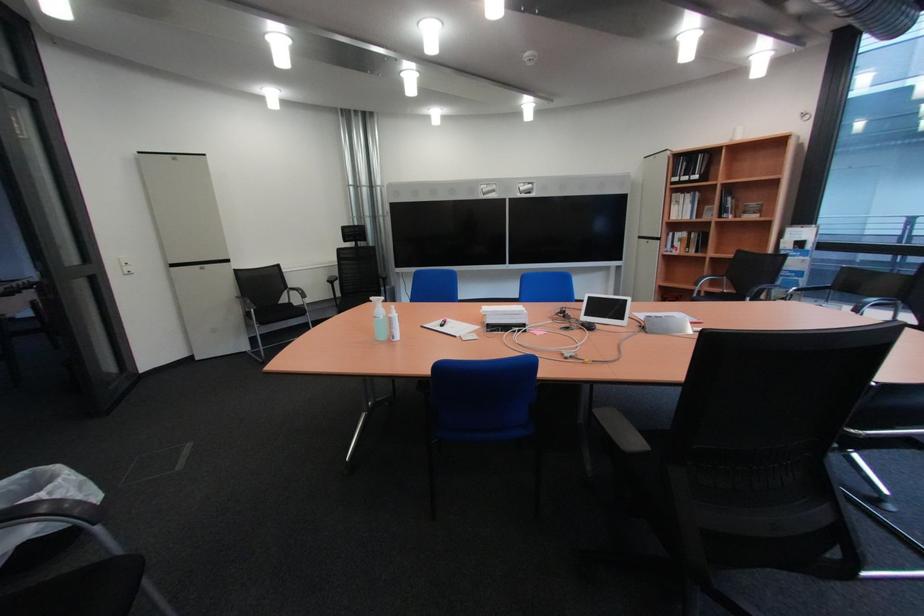
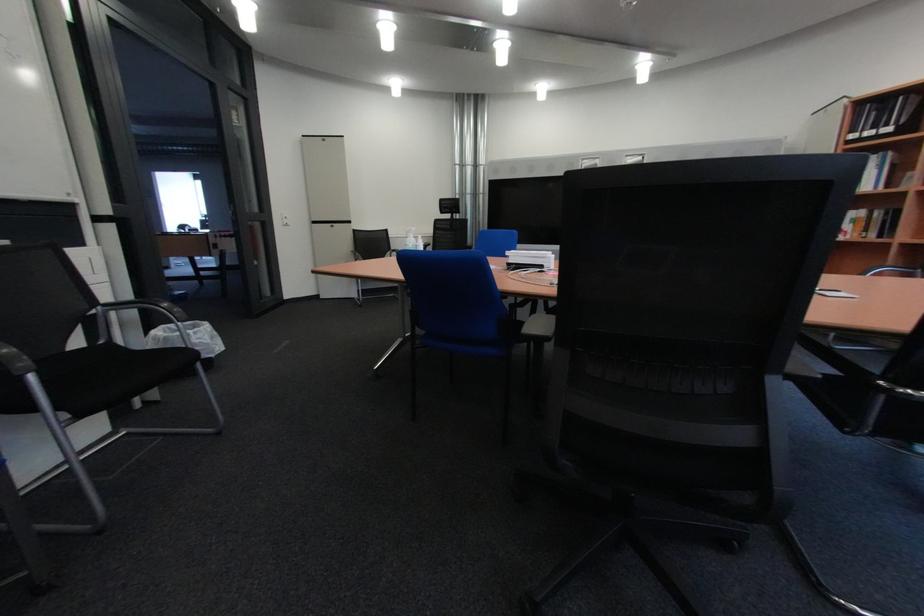
Question: In a continuous first-person perspective shot, in which direction is the camera moving?

Choices:
 (A) Left
 (B) Right
 (C) Forward
 (D) Backward

Answer: (B)